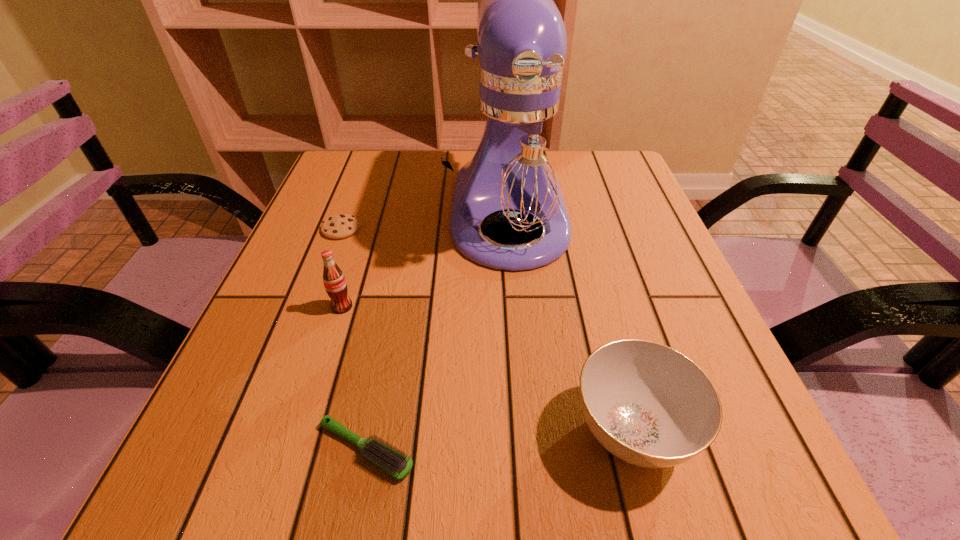
You are a GUI agent. You are given a task and a screenshot of the screen. Output one action in this format:
    pyautogui.click(x=<x>, y=<y>)
    Task: Click on the vacant space at the right edge
    
    Given the screenshot: What is the action you would take?
    pyautogui.click(x=614, y=222)

In the image, there is a desktop. At what (x,y) coordinates should I click in order to perform the action: click on free space at the far left corner. Please return your answer as a coordinate pair (x, y). Looking at the image, I should click on (328, 177).

I want to click on free space at the near left corner, so click(237, 485).

Locate an element on the screen. This screenshot has width=960, height=540. unoccupied position between the cookie and the chinaware is located at coordinates (487, 330).

This screenshot has width=960, height=540. Find the location of `vacant space that's between the hairbrush and the mixer`. vacant space that's between the hairbrush and the mixer is located at coordinates (438, 332).

The height and width of the screenshot is (540, 960). Find the location of `vacant region between the mixer and the cookie`. vacant region between the mixer and the cookie is located at coordinates (425, 222).

Locate an element on the screen. This screenshot has width=960, height=540. empty space that is in between the hairbrush and the fourth shortest object is located at coordinates (354, 378).

The height and width of the screenshot is (540, 960). I want to click on vacant area between the hairbrush and the mixer, so click(x=438, y=332).

Locate an element on the screen. This screenshot has height=540, width=960. free spot between the soda and the third object from left to right is located at coordinates (354, 378).

This screenshot has height=540, width=960. I want to click on free area in between the chinaware and the soda, so click(x=487, y=368).